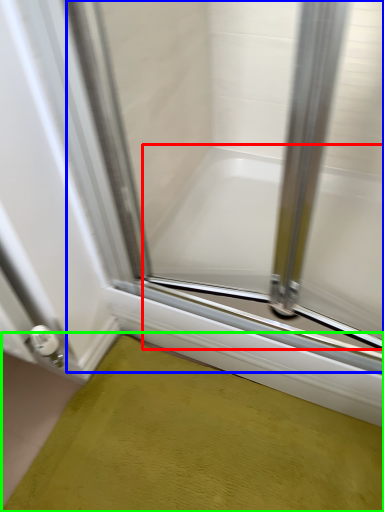
Question: Which object is the farthest from bathtub (highlighted by a red box)? Choose among these: glass door (highlighted by a blue box) or bath mat (highlighted by a green box).

Choices:
 (A) glass door
 (B) bath mat

Answer: (B)